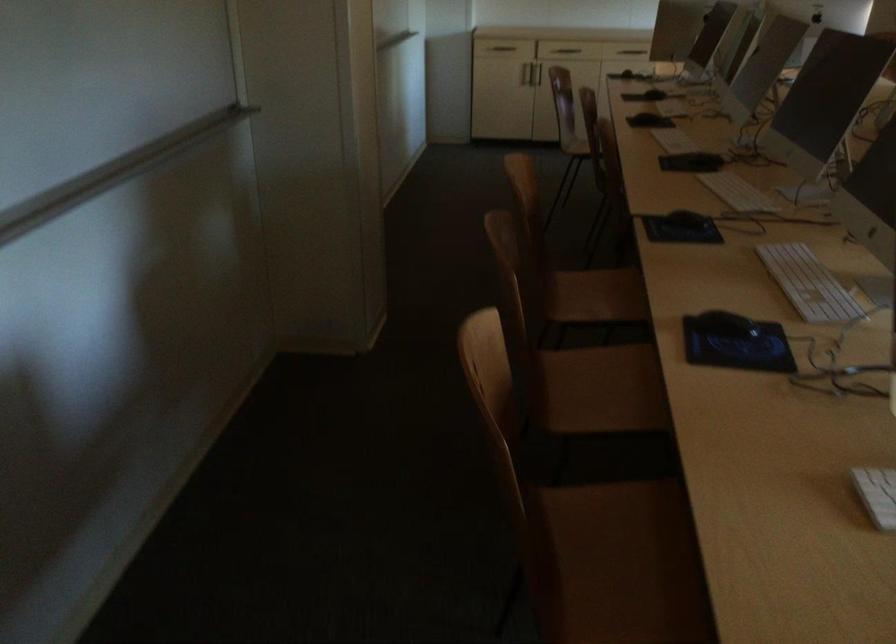
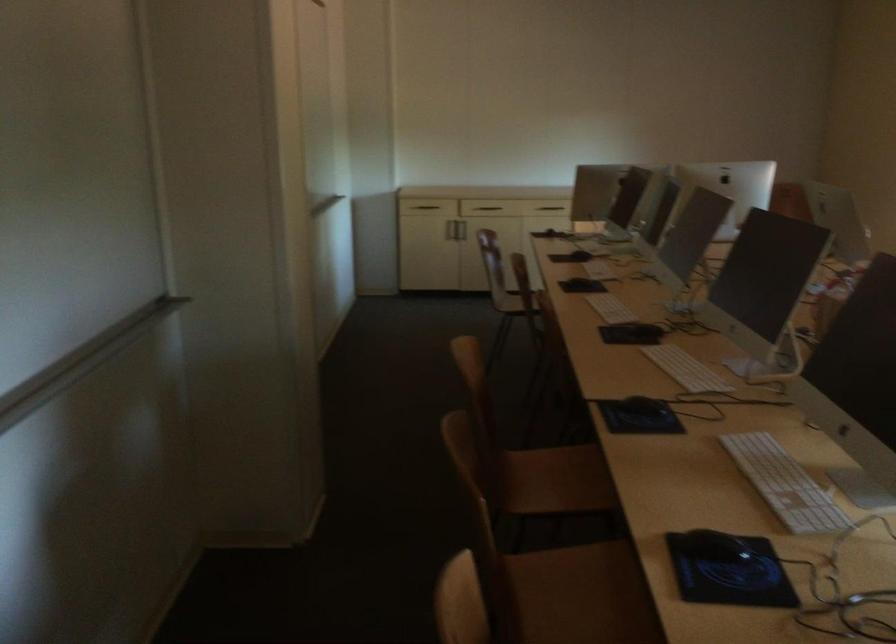
The point at (x=673, y=138) is marked in the first image. Where is the corresponding point in the second image?

(609, 308)